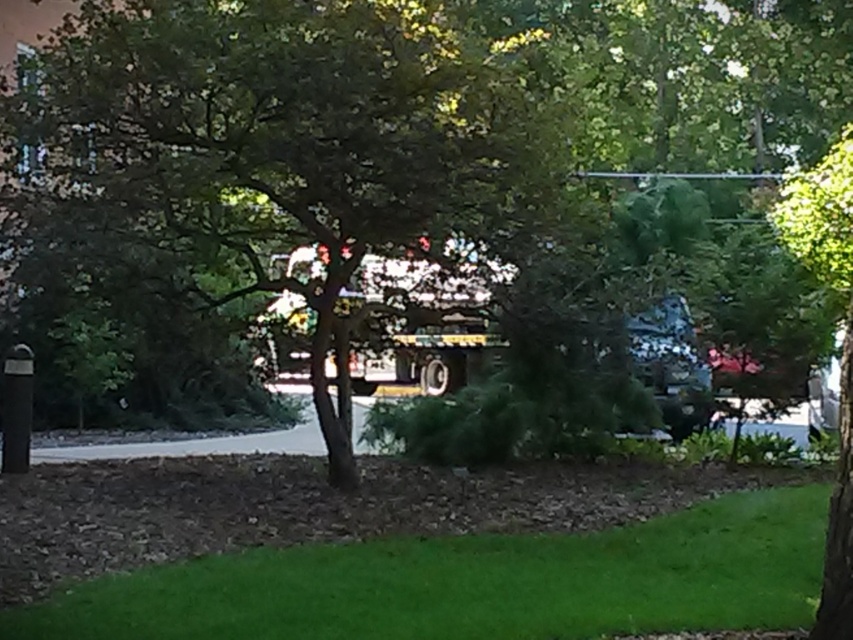
Which is behind, point (521, 97) or point (498, 584)?

Positioned behind is point (521, 97).

Is green leafy tree at center in front of green grass at lower center?

No, it is behind green grass at lower center.

Is point (361, 124) farther from viewer compared to point (228, 624)?

Yes, it is behind point (228, 624).

Where is `green leafy tree at center`? Image resolution: width=853 pixels, height=640 pixels. green leafy tree at center is located at coordinates (296, 172).